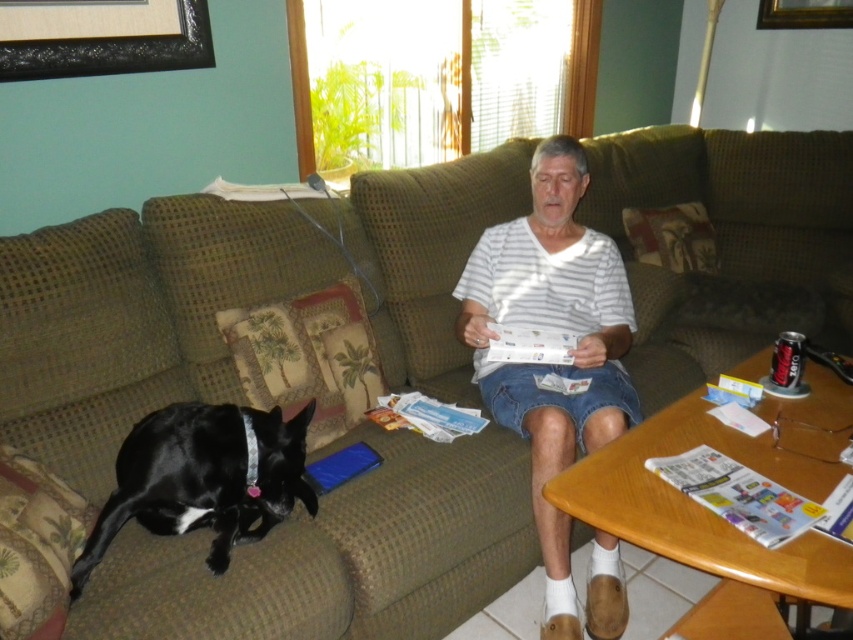
Does white striped shirt at center have a lesser height compared to black matte picture frame at upper left?

No, white striped shirt at center is not shorter than black matte picture frame at upper left.

Who is taller, white striped shirt at center or black matte picture frame at upper left?

white striped shirt at center is taller.

Is point (476, 372) positioned after point (30, 12)?

That is True.

The image size is (853, 640). What are the coordinates of `white striped shirt at center` in the screenshot? It's located at (552, 326).

Is white striped shirt at center positioned behind black shiny dog at lower left?

Yes, white striped shirt at center is further from the viewer.

Can you confirm if white striped shirt at center is positioned to the left of black shiny dog at lower left?

No, white striped shirt at center is not to the left of black shiny dog at lower left.

Is point (605, 330) more distant than point (157, 452)?

Yes, point (605, 330) is behind point (157, 452).

I want to click on white striped shirt at center, so click(x=552, y=326).

Is black shiny dog at lower left below black matte picture frame at upper left?

Indeed, black shiny dog at lower left is positioned under black matte picture frame at upper left.

Which of these two, black shiny dog at lower left or black matte picture frame at upper left, stands shorter?

black matte picture frame at upper left is shorter.

Which is behind, point (201, 424) or point (183, 61)?

The point (183, 61) is more distant.

Locate an element on the screen. black shiny dog at lower left is located at coordinates (202, 477).